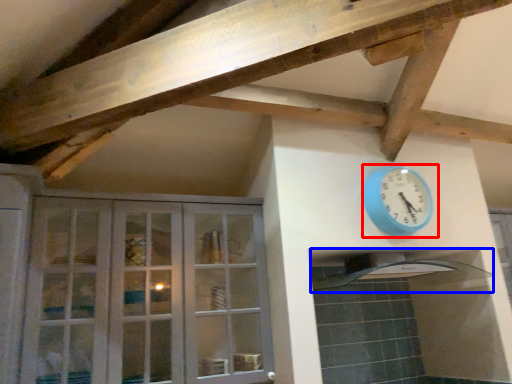
Question: Among these objects, which one is nearest to the camera, wall clock (highlighted by a red box) or exhaust hood (highlighted by a blue box)?

Choices:
 (A) wall clock
 (B) exhaust hood

Answer: (B)